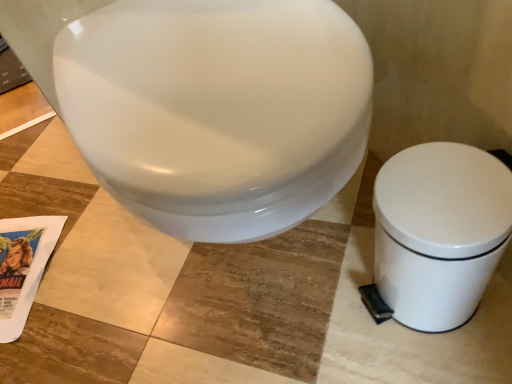
What is the approximate width of white glossy trash can at lower right?

white glossy trash can at lower right is 7.05 inches in width.

At what (x,y) coordinates should I click in order to perform the action: click on white glossy trash can at lower right. Please return your answer as a coordinate pair (x, y). The image size is (512, 384). Looking at the image, I should click on (439, 232).

What is the approximate height of white glossy trash can at lower right?

white glossy trash can at lower right is 10.18 inches in height.

This screenshot has height=384, width=512. What do you see at coordinates (439, 232) in the screenshot? I see `white glossy trash can at lower right` at bounding box center [439, 232].

Image resolution: width=512 pixels, height=384 pixels. In order to click on white glossy trash can at lower right in this screenshot , I will do `click(439, 232)`.